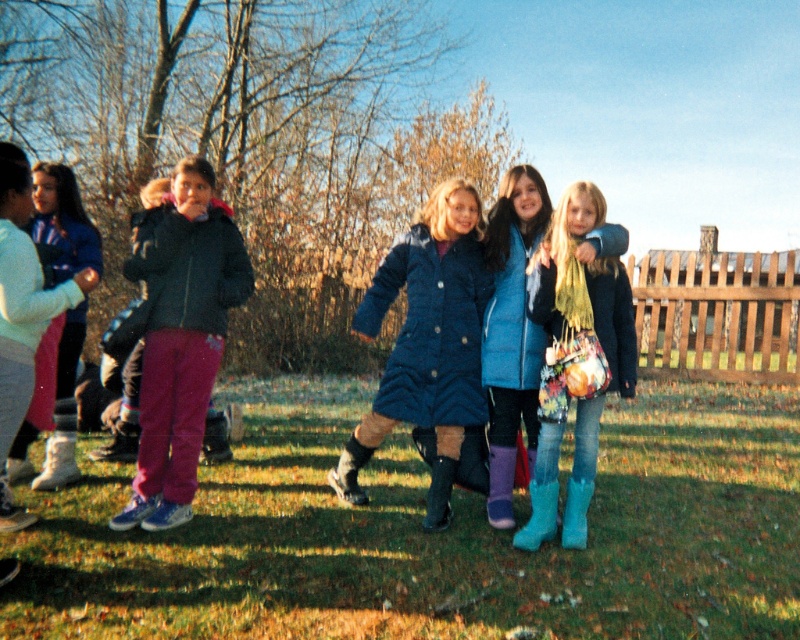
Looking at this image, you are a photographer trying to capture a photo of the blue rubber boot at center without including the quilted blue coat at center in the frame. Is this possible given their positions?

The quilted blue coat at center is located above the blue rubber boot at center, so it would be difficult to capture the blue rubber boot at center without including the quilted blue coat at center in the frame.

You are a photographer standing at the edge of the grassy area. You want to take a photo that includes both the quilted blue coat at center and the wooden fence in the background. Given that the distance between them is 5.09 meters, will you need to adjust your camera settings to focus on both subjects clearly?

The distance between the quilted blue coat at center and the wooden fence in the background is 5.09 meters. To ensure both are in focus, you may need to adjust your camera settings, such as using a smaller aperture for a deeper depth of field, depending on your camera lens and shooting conditions.

You are standing at the origin point of the coordinate system where the lower left corner of the image is the origin. The image has a coordinate system where the x and y axes go from 0 to 1. You want to place a small red flag at the location of the green grass at lower center. What coordinates should you use to place the flag?

The coordinates for the green grass at lower center are at point (434, 534). So you should place the flag at coordinates 0.836 on the x axis and 0.544 on the y axis.